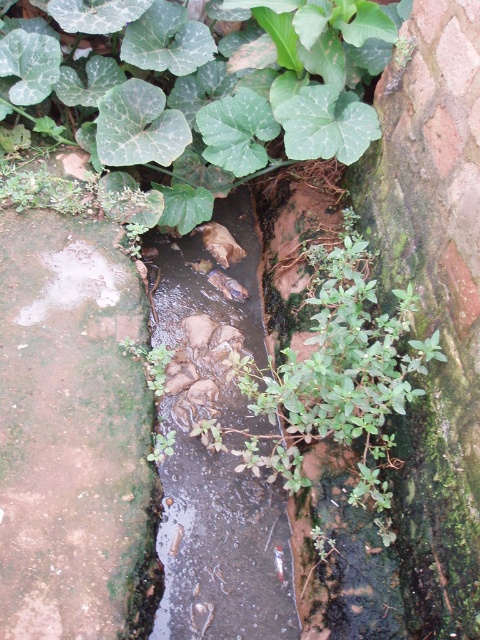
Question: Does green leafy plant at upper center have a smaller size compared to clear water at center?

Choices:
 (A) yes
 (B) no

Answer: (B)

Question: Which object appears farthest from the camera in this image?

Choices:
 (A) clear water at center
 (B) green leafy plant at upper center

Answer: (B)

Question: Which object is closer to the camera taking this photo?

Choices:
 (A) green leafy plant at upper center
 (B) clear water at center

Answer: (B)

Question: Can you confirm if green leafy plant at upper center is bigger than clear water at center?

Choices:
 (A) yes
 (B) no

Answer: (A)

Question: From the image, what is the correct spatial relationship of green leafy plant at upper center in relation to clear water at center?

Choices:
 (A) below
 (B) above

Answer: (B)